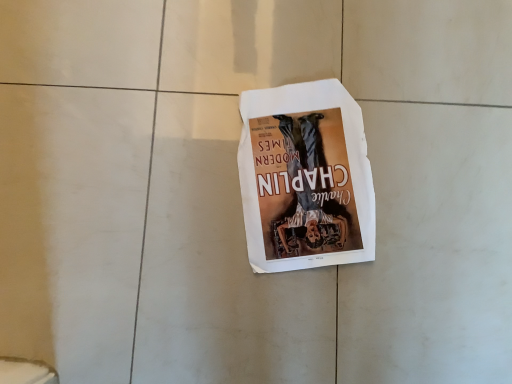
This screenshot has width=512, height=384. Describe the element at coordinates (305, 178) in the screenshot. I see `matte paper poster at center` at that location.

At what (x,y) coordinates should I click in order to perform the action: click on matte paper poster at center. Please return your answer as a coordinate pair (x, y). The height and width of the screenshot is (384, 512). Looking at the image, I should click on (305, 178).

Measure the distance between point (x=285, y=256) and camera.

A distance of 25.39 inches exists between point (x=285, y=256) and camera.

Locate an element on the screen. The width and height of the screenshot is (512, 384). matte paper poster at center is located at coordinates (305, 178).